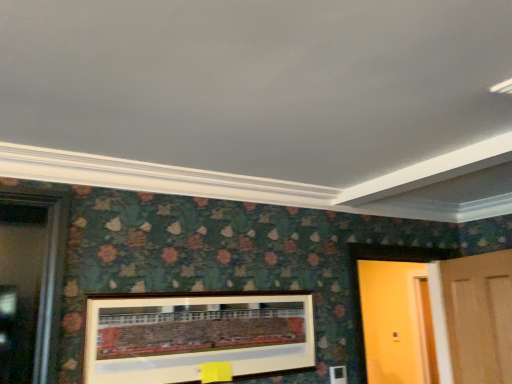
Question: From a real-world perspective, is wooden door at right, which is the first door in left-to-right order, physically below wooden door at right, the second door positioned from the left?

Choices:
 (A) no
 (B) yes

Answer: (A)

Question: Does wooden door at right, the 2th door in the right-to-left sequence, have a larger size compared to wooden door at right, which is the first door in right-to-left order?

Choices:
 (A) yes
 (B) no

Answer: (A)

Question: Are wooden door at right, which is the first door in left-to-right order, and wooden door at right, which is the first door in right-to-left order, beside each other?

Choices:
 (A) no
 (B) yes

Answer: (A)

Question: Is wooden door at right, which is the first door in right-to-left order, inside wooden door at right, which is the first door in left-to-right order?

Choices:
 (A) no
 (B) yes

Answer: (A)

Question: Is the position of wooden door at right, the 2th door in the right-to-left sequence, more distant than that of wooden door at right, the second door positioned from the left?

Choices:
 (A) no
 (B) yes

Answer: (B)

Question: Looking at the image, does wooden door at right, which is the first door in left-to-right order, seem bigger or smaller compared to wooden picture frame at center?

Choices:
 (A) big
 (B) small

Answer: (A)

Question: From a real-world perspective, is wooden door at right, which is the first door in left-to-right order, physically located above or below wooden picture frame at center?

Choices:
 (A) above
 (B) below

Answer: (A)

Question: From the image's perspective, is wooden door at right, which is the first door in left-to-right order, above or below wooden picture frame at center?

Choices:
 (A) above
 (B) below

Answer: (B)

Question: Choose the correct answer: Is wooden door at right, which is the first door in left-to-right order, inside wooden picture frame at center or outside it?

Choices:
 (A) inside
 (B) outside

Answer: (B)

Question: Is wooden picture frame at center situated inside wooden door at right, the second door positioned from the left, or outside?

Choices:
 (A) outside
 (B) inside

Answer: (A)

Question: From a real-world perspective, relative to wooden door at right, which is the first door in right-to-left order, is wooden picture frame at center vertically above or below?

Choices:
 (A) below
 (B) above

Answer: (A)

Question: Considering the relative positions of wooden picture frame at center and wooden door at right, the second door positioned from the left, in the image provided, is wooden picture frame at center to the left or to the right of wooden door at right, the second door positioned from the left,?

Choices:
 (A) left
 (B) right

Answer: (A)

Question: From the image's perspective, is wooden picture frame at center positioned above or below wooden door at right, which is the first door in right-to-left order?

Choices:
 (A) below
 (B) above

Answer: (B)

Question: From the image's perspective, is wooden picture frame at center positioned above or below wooden door at right, the 2th door in the right-to-left sequence?

Choices:
 (A) below
 (B) above

Answer: (B)

Question: Is wooden picture frame at center situated inside wooden door at right, which is the first door in left-to-right order, or outside?

Choices:
 (A) inside
 (B) outside

Answer: (B)